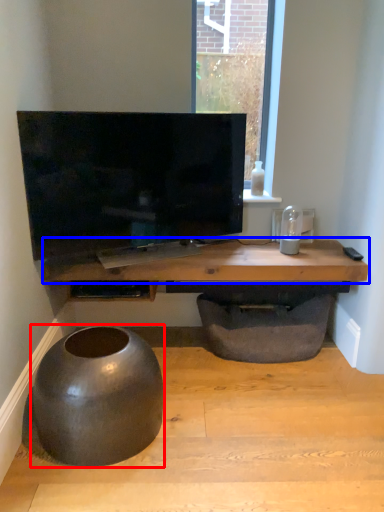
Question: Which point is closer to the camera, round table (highlighted by a red box) or table (highlighted by a blue box)?

Choices:
 (A) round table
 (B) table

Answer: (A)